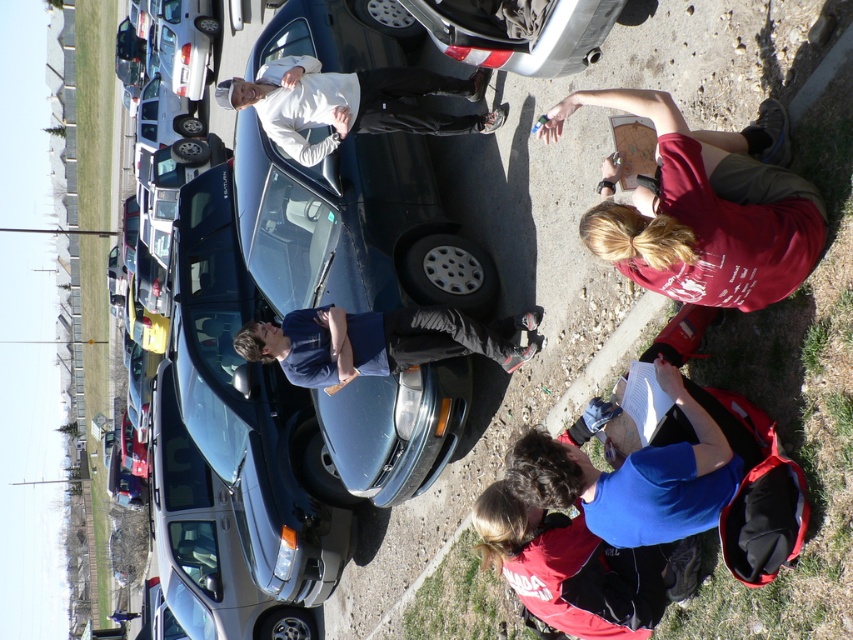
Question: Can you confirm if shiny blue sedan at center is wider than blue matte shirt at lower right?

Choices:
 (A) yes
 (B) no

Answer: (A)

Question: Does shiny blue sedan at center have a larger size compared to white matte shirt at center?

Choices:
 (A) no
 (B) yes

Answer: (B)

Question: Is red fabric shirt at lower center positioned behind white matte shirt at center?

Choices:
 (A) yes
 (B) no

Answer: (B)

Question: Considering the real-world distances, which object is closest to the red fabric shirt at lower center?

Choices:
 (A) blue matte shirt at lower right
 (B) matte red shirt at lower right
 (C) white matte shirt at center

Answer: (A)

Question: Which object is the farthest from the satin silver sedan at lower left?

Choices:
 (A) matte red shirt at lower right
 (B) red fabric shirt at lower center
 (C) blue matte shirt at lower right

Answer: (A)

Question: Which object is closer to the camera taking this photo?

Choices:
 (A) satin silver sedan at lower left
 (B) blue matte shirt at lower right
 (C) blue fabric shirt at center
 (D) matte red shirt at lower right

Answer: (D)